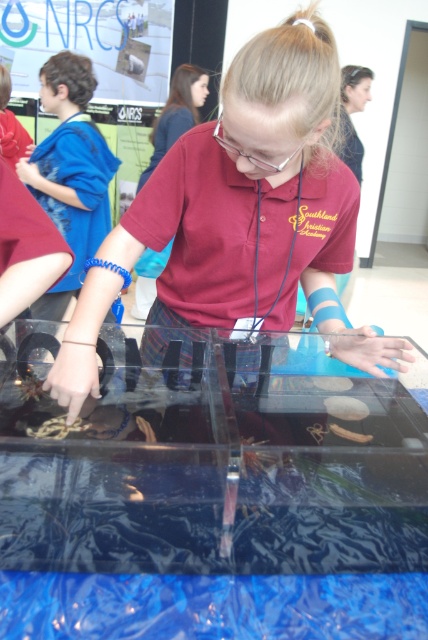
Question: Which object is closer to the camera taking this photo?

Choices:
 (A) matte plastic container at center
 (B) clear plastic goggles at center
 (C) transparent acrylic table at center

Answer: (C)

Question: Which object is positioned closest to the clear plastic goggles at center?

Choices:
 (A) matte plastic container at center
 (B) maroon fabric shirt at center
 (C) blue fabric wristband at upper left

Answer: (A)

Question: Is transparent acrylic table at center bigger than maroon fabric shirt at center?

Choices:
 (A) yes
 (B) no

Answer: (B)

Question: Can you confirm if matte plastic container at center is positioned to the right of maroon fabric shirt at center?

Choices:
 (A) no
 (B) yes

Answer: (B)

Question: Estimate the real-world distances between objects in this image. Which object is closer to the matte plastic container at center?

Choices:
 (A) blue fabric wristband at upper left
 (B) clear plastic goggles at center
 (C) transparent acrylic table at center

Answer: (C)

Question: Can you confirm if transparent acrylic table at center is positioned to the right of clear plastic goggles at center?

Choices:
 (A) yes
 (B) no

Answer: (B)